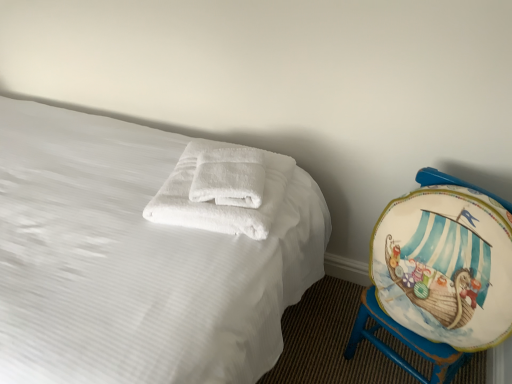
Locate an element on the screen. Image resolution: width=512 pixels, height=384 pixels. vacant area on top of white soft towel at center (from a real-world perspective) is located at coordinates click(x=228, y=172).